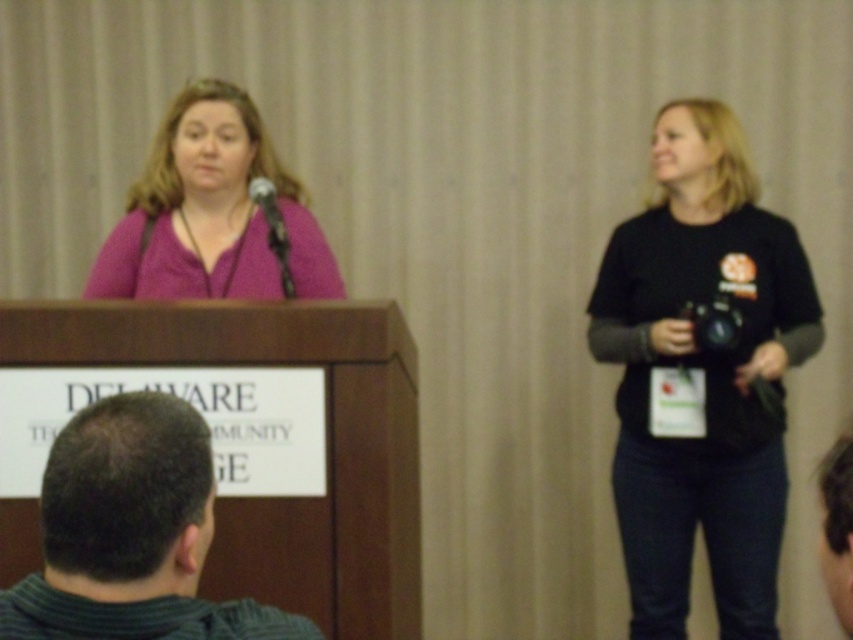
Question: Which of the following is the farthest from the observer?

Choices:
 (A) black matte shirt at right
 (B) matte pink shirt at center

Answer: (A)

Question: Among these objects, which one is farthest from the camera?

Choices:
 (A) dark green striped shirt at lower left
 (B) dark brown hair at lower right
 (C) black matte shirt at right
 (D) matte black microphone at center

Answer: (C)

Question: Among these objects, which one is nearest to the camera?

Choices:
 (A) black matte shirt at right
 (B) dark brown hair at lower right
 (C) dark green striped shirt at lower left
 (D) matte pink shirt at center

Answer: (B)

Question: Is dark green striped shirt at lower left thinner than dark brown hair at lower right?

Choices:
 (A) no
 (B) yes

Answer: (A)

Question: Is black matte shirt at right to the left of matte black microphone at center from the viewer's perspective?

Choices:
 (A) yes
 (B) no

Answer: (B)

Question: Does dark brown hair at lower right appear over matte black microphone at center?

Choices:
 (A) yes
 (B) no

Answer: (B)